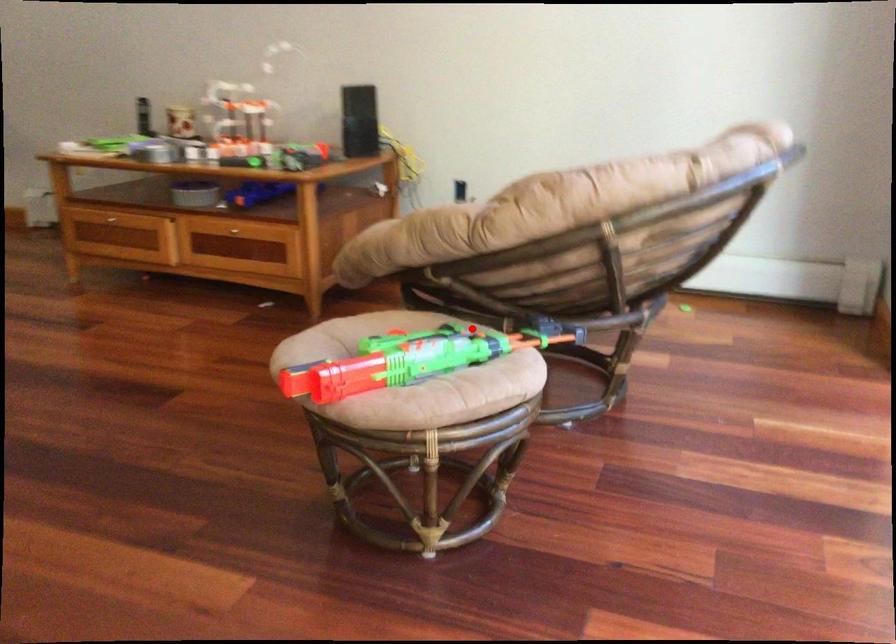
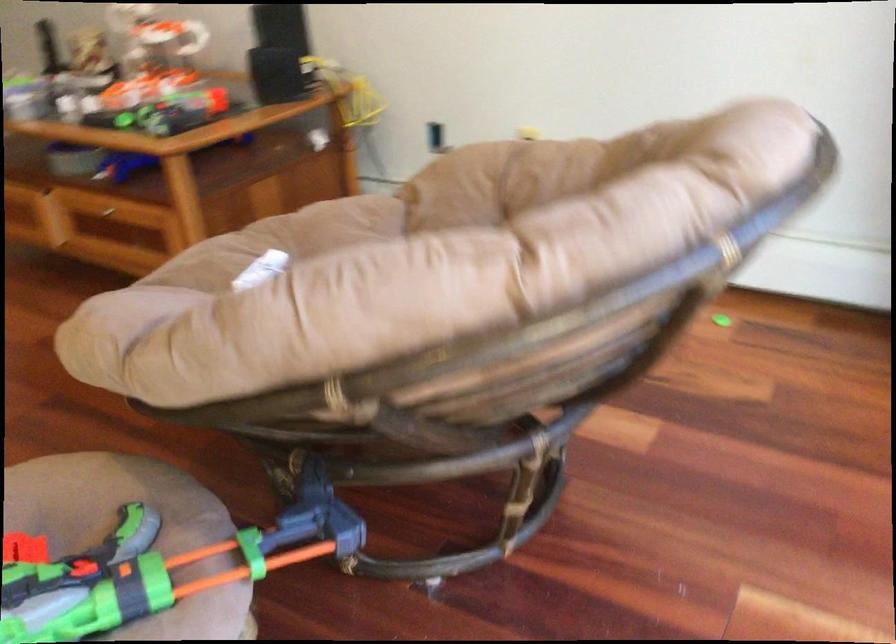
Question: I am providing you with two images of the same scene from different viewpoints. A red point is shown in image1. For the corresponding object point in image2, is it positioned nearer or farther from the camera?

Choices:
 (A) Nearer
 (B) Farther

Answer: (A)